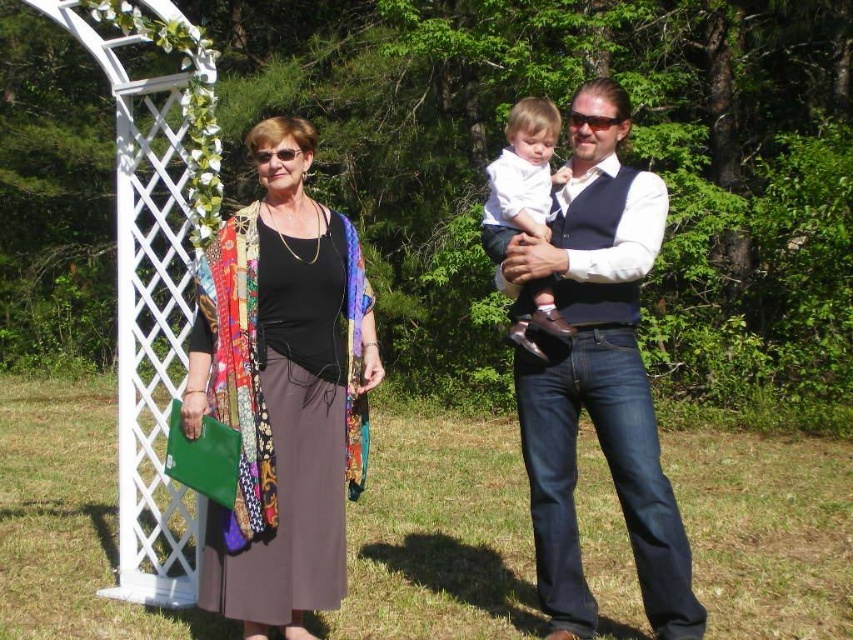
Question: Among these points, which one is nearest to the camera?

Choices:
 (A) (654, 182)
 (B) (265, 358)

Answer: (B)

Question: Which of the following is the farthest from the observer?

Choices:
 (A) (358, 312)
 (B) (561, 232)
 (C) (509, 156)

Answer: (A)

Question: Which point is farther from the camera taking this photo?

Choices:
 (A) (572, 301)
 (B) (271, 200)
 (C) (563, 177)

Answer: (C)

Question: Can you confirm if matte white shirt at center is wider than white soft fabric baby at center?

Choices:
 (A) yes
 (B) no

Answer: (A)

Question: In this image, where is matte white shirt at center located relative to white soft fabric baby at center?

Choices:
 (A) left
 (B) right

Answer: (B)

Question: Does multicolored fabric shawl at left come in front of white soft fabric baby at center?

Choices:
 (A) no
 (B) yes

Answer: (B)